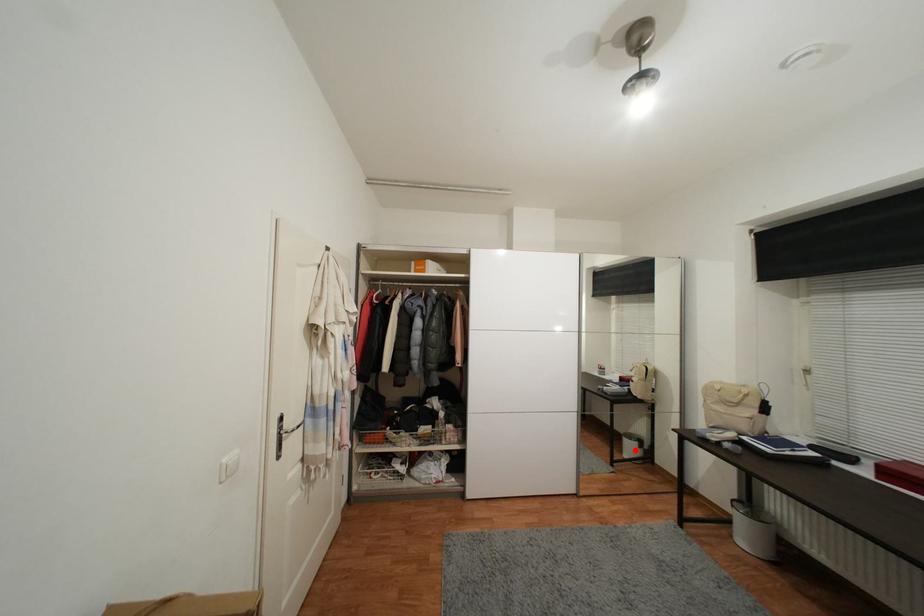
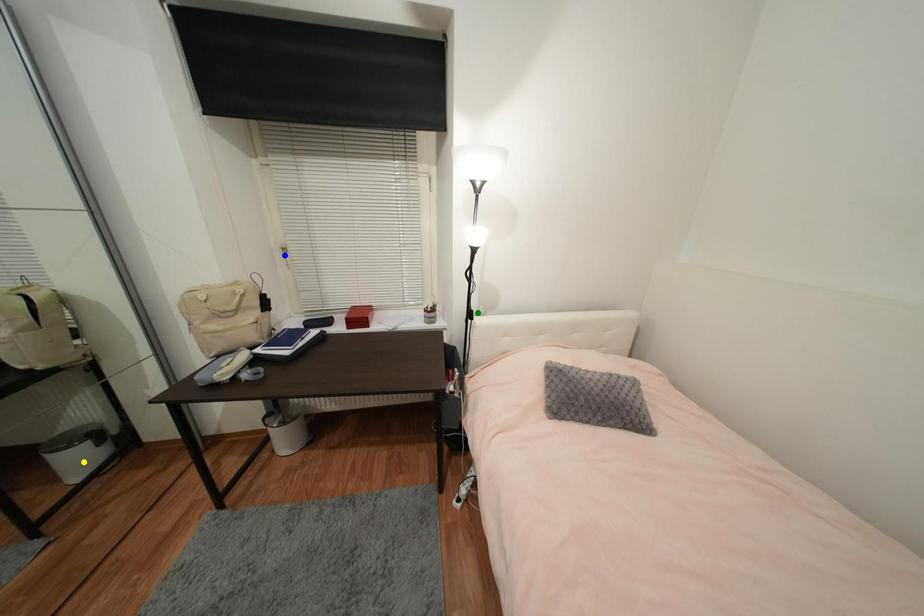
Question: I am providing you with two images of the same scene from different viewpoints. A red point is marked on the first image. You are given multiple points on the second image. Can you choose the point in image 2 that corresponds to the point in image 1?

Choices:
 (A) yellow point
 (B) green point
 (C) blue point

Answer: (A)